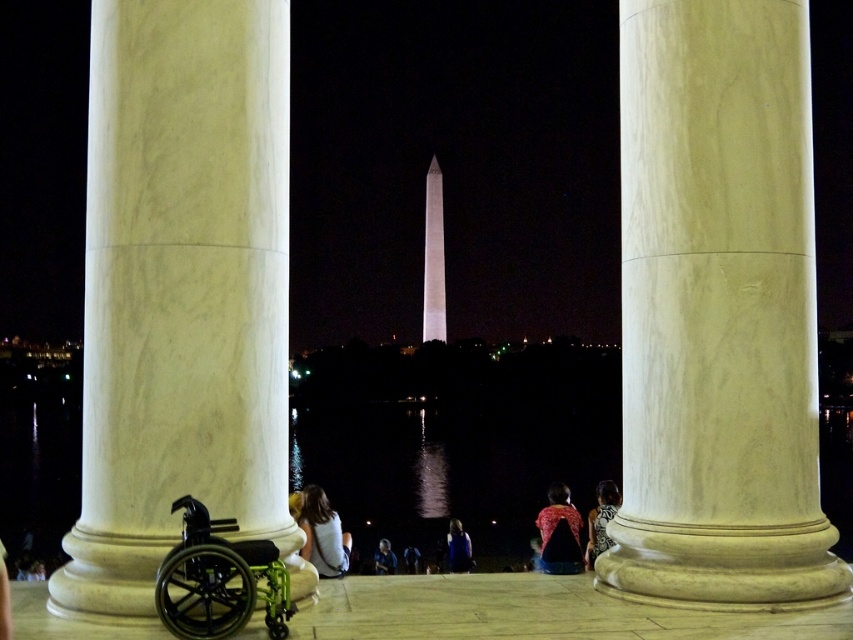
Question: Which is farther from the white marble pillar at left?

Choices:
 (A) red patterned shirt at center
 (B) blue fabric jacket at center
 (C) green plastic wheelchair at lower left

Answer: (B)

Question: Is white marble pillar at left below red patterned shirt at center?

Choices:
 (A) yes
 (B) no

Answer: (B)

Question: Can you confirm if white marble pillar at left is smaller than red patterned shirt at center?

Choices:
 (A) yes
 (B) no

Answer: (B)

Question: Does white marble column at center have a greater width compared to white marble tower at center?

Choices:
 (A) no
 (B) yes

Answer: (B)

Question: Which point is farther to the camera?

Choices:
 (A) white marble pillar at left
 (B) dark hair at center

Answer: (B)

Question: Which of the following is the closest to the observer?

Choices:
 (A) dark hair at center
 (B) white matte shirt at center

Answer: (B)